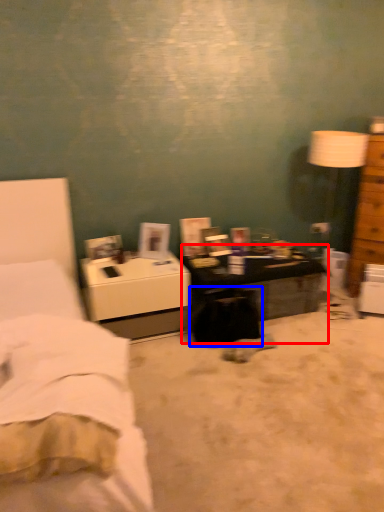
Question: Which object is further to the camera taking this photo, desk (highlighted by a red box) or swivel chair (highlighted by a blue box)?

Choices:
 (A) desk
 (B) swivel chair

Answer: (A)